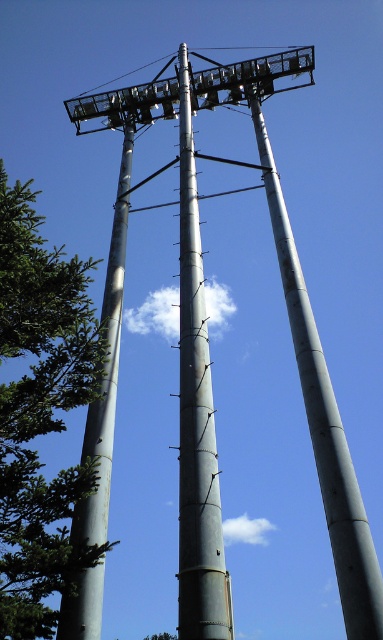
Question: Based on their relative distances, which object is farther from the metallic gray power line at upper center?

Choices:
 (A) smooth metallic pole at center
 (B) green matte tree at left
 (C) silver metallic pole at left

Answer: (B)

Question: Does silver metallic pole at left have a larger size compared to metallic gray power line at upper center?

Choices:
 (A) no
 (B) yes

Answer: (B)

Question: Does metallic gray pole at center have a greater width compared to smooth metallic pole at center?

Choices:
 (A) yes
 (B) no

Answer: (A)

Question: Which of the following is the closest to the observer?

Choices:
 (A) smooth metallic pole at center
 (B) metallic gray power line at upper center
 (C) green matte tree at left

Answer: (C)

Question: Which of the following is the farthest from the observer?

Choices:
 (A) (73, 508)
 (B) (148, 61)

Answer: (B)

Question: Can you confirm if metallic gray pole at center is smaller than metallic gray power line at upper center?

Choices:
 (A) no
 (B) yes

Answer: (A)